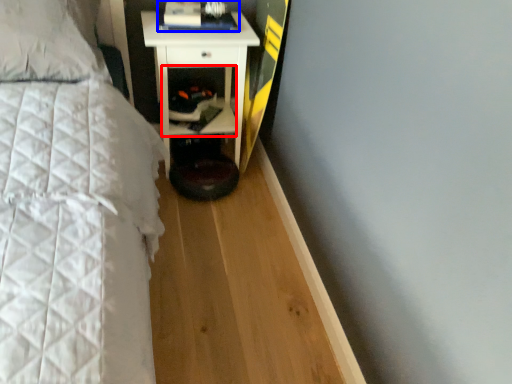
Question: Which object is further to the camera taking this photo, cabinet (highlighted by a red box) or book (highlighted by a blue box)?

Choices:
 (A) cabinet
 (B) book

Answer: (A)